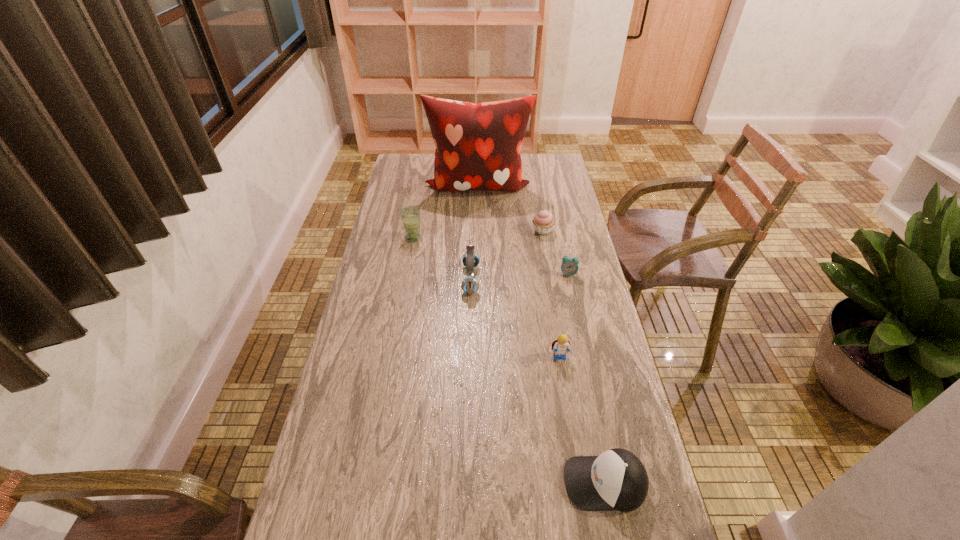
The image size is (960, 540). I want to click on cupcake located in the right edge section of the desktop, so click(x=543, y=222).

What are the coordinates of `Lego at the right edge` in the screenshot? It's located at (560, 346).

I want to click on cap that is at the right edge, so click(616, 480).

Where is `alarm clock located in the right edge section of the desktop`? alarm clock located in the right edge section of the desktop is located at coordinates (569, 266).

The height and width of the screenshot is (540, 960). What are the coordinates of `object situated at the far left corner` in the screenshot? It's located at (478, 146).

In the image, there is a desktop. Identify the location of free space at the far edge. (431, 178).

This screenshot has height=540, width=960. Identify the location of free space at the left edge. (410, 189).

Where is `vacant region at the right edge of the desktop`? This screenshot has width=960, height=540. vacant region at the right edge of the desktop is located at coordinates (629, 435).

This screenshot has width=960, height=540. I want to click on vacant point at the far left corner, so tap(422, 154).

Identify the location of free space between the cap and the cushion. (541, 334).